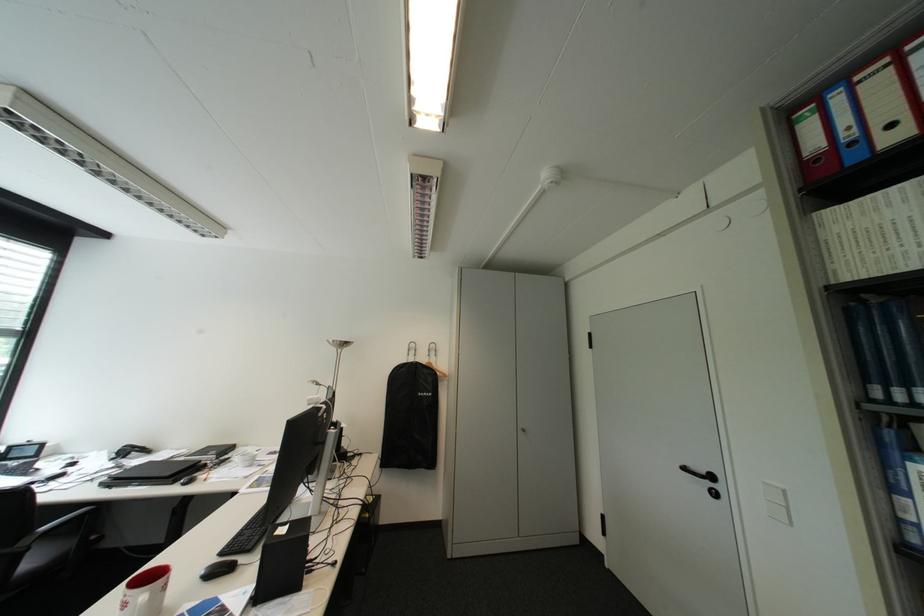
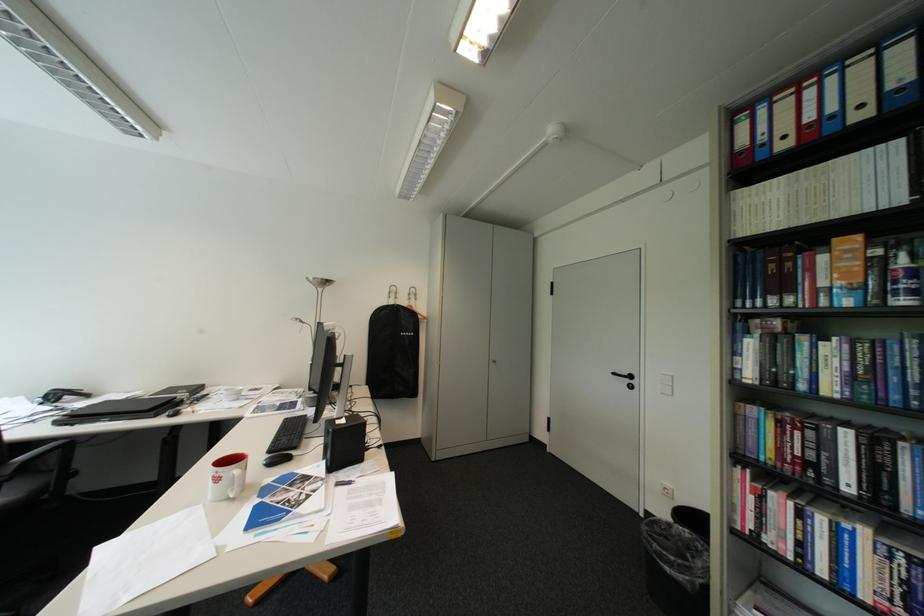
In the second image, find the point that corresponds to the point at 214,573 in the first image.

(276, 463)